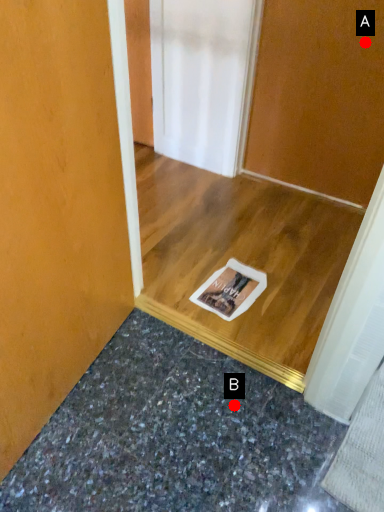
Question: Two points are circled on the image, labeled by A and B beside each circle. Which of the following is the farthest from the observer?

Choices:
 (A) A is further
 (B) B is further

Answer: (A)